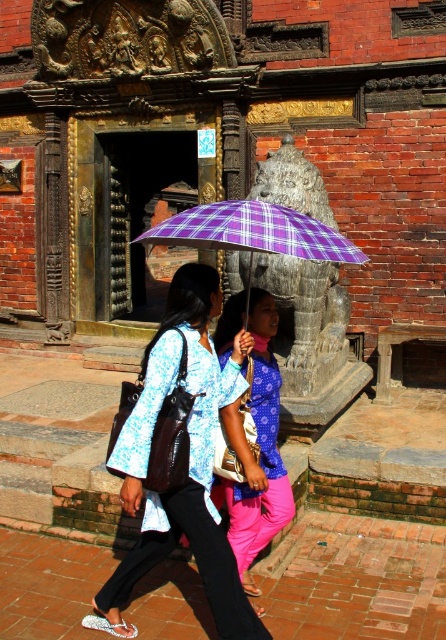
You are a tour guide leading visitors through this historical site. You notice two items at the center of the scene. Which item is positioned to the left when looking at the matte blue blouse at center and the purple checkered umbrella at center?

The matte blue blouse at center is to the left of the purple checkered umbrella at center.

You are a tour guide leading a group through this historical site. You notice two items at the center of the scene. Which item is closer to the camera, the matte blue blouse at center or the matte purple umbrella at center?

The matte blue blouse at center is closer to the camera because it is in front of the matte purple umbrella at center.